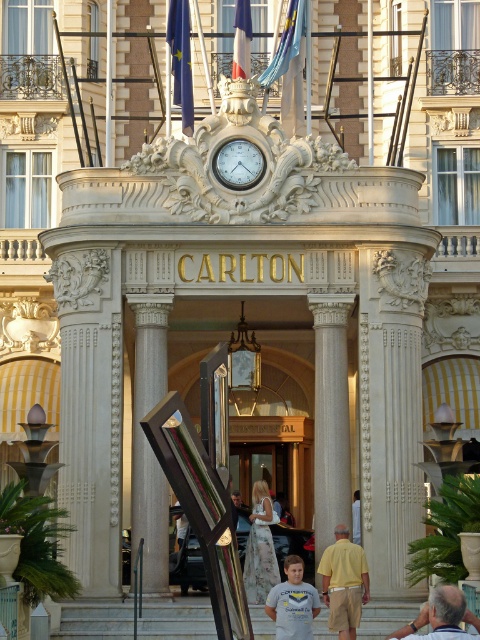
You are standing at the entrance of the Carlton Hotel and want to take a photo of the gold metallic clock at center and the white marble pillar at center. Which object should you focus on first if you want to capture both in a single frame without moving your camera?

You should focus on the white marble pillar at center first because it is below the gold metallic clock at center, so adjusting the camera angle to include both would require framing from the bottom up.

You are a delivery person who needs to unload a package that requires a 30 feet clearance between two objects. You see the white marble column at center and the gold metallic clock at center. Can you safely unload your package here?

The white marble column at center and gold metallic clock at center are 29.91 feet apart from each other, which is less than the required 30 feet clearance. Therefore, you cannot safely unload your package here.